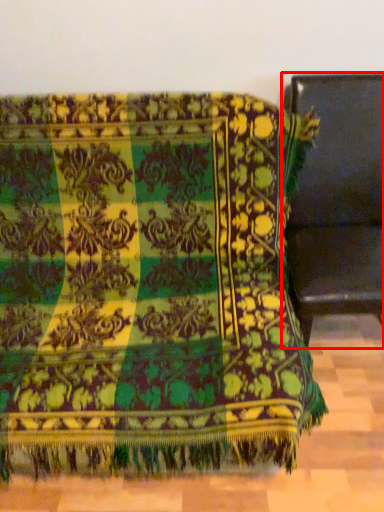
Question: In this image, where is furniture (annotated by the red box) located relative to furniture?

Choices:
 (A) left
 (B) right

Answer: (B)